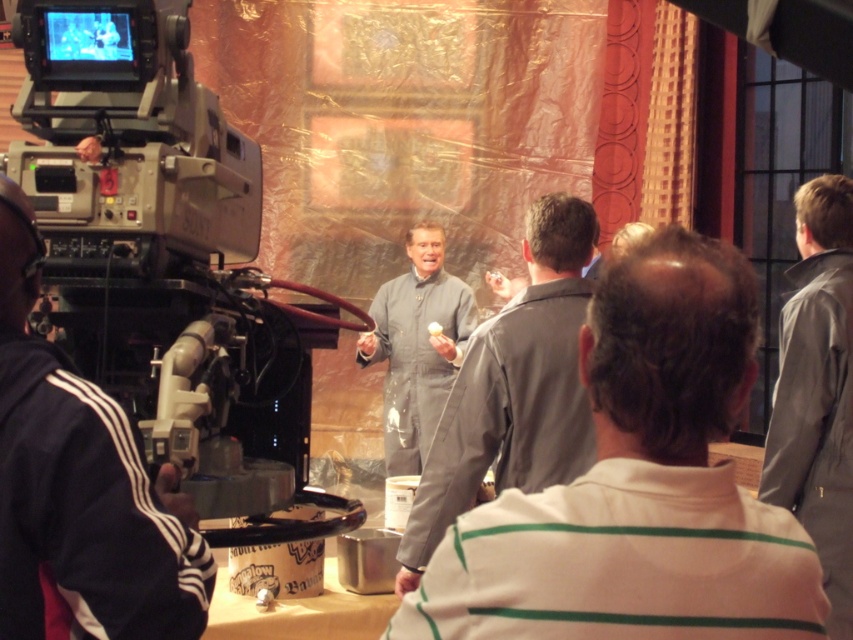
Question: Which of these objects is positioned closest to the gray fabric suit at center?

Choices:
 (A) gray leather jacket at right
 (B) matte gray suit at center

Answer: (A)

Question: Is the position of black matte camera at left more distant than that of gray leather jacket at right?

Choices:
 (A) no
 (B) yes

Answer: (A)

Question: Can you confirm if gray fabric suit at center is bigger than gray leather jacket at right?

Choices:
 (A) no
 (B) yes

Answer: (A)

Question: Considering the relative positions of black matte camera at left and matte gray jumpsuit at center in the image provided, where is black matte camera at left located with respect to matte gray jumpsuit at center?

Choices:
 (A) left
 (B) right

Answer: (A)

Question: Which of the following is the farthest from the observer?

Choices:
 (A) (407, 445)
 (B) (102, 508)
 (C) (769, 428)

Answer: (A)

Question: Which point appears closest to the camera in this image?

Choices:
 (A) (15, 28)
 (B) (798, 515)
 (C) (6, 467)
 (D) (576, 400)

Answer: (C)